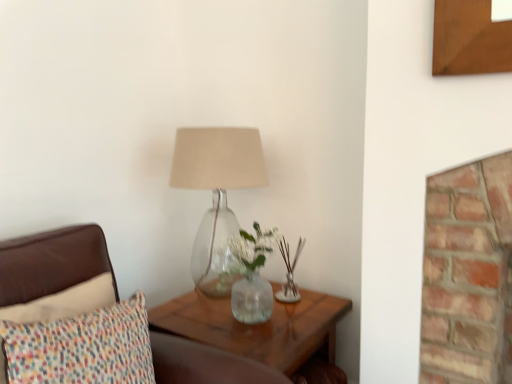
Question: Is multicolored fabric pillow at left a part of translucent wood table at lower right?

Choices:
 (A) no
 (B) yes

Answer: (A)

Question: From a real-world perspective, is translucent wood table at lower right over multicolored fabric pillow at left?

Choices:
 (A) yes
 (B) no

Answer: (B)

Question: Is translucent wood table at lower right placed right next to multicolored fabric pillow at left?

Choices:
 (A) no
 (B) yes

Answer: (A)

Question: From a real-world perspective, is translucent wood table at lower right beneath multicolored fabric pillow at left?

Choices:
 (A) no
 (B) yes

Answer: (B)

Question: Is translucent wood table at lower right positioned far away from multicolored fabric pillow at left?

Choices:
 (A) no
 (B) yes

Answer: (A)

Question: Is translucent wood table at lower right facing away from multicolored fabric pillow at left?

Choices:
 (A) no
 (B) yes

Answer: (A)

Question: Is translucent glass lamp at center to the left of multicolored fabric pillow at left from the viewer's perspective?

Choices:
 (A) yes
 (B) no

Answer: (B)

Question: Is translucent glass lamp at center positioned behind multicolored fabric pillow at left?

Choices:
 (A) no
 (B) yes

Answer: (B)

Question: Considering the relative sizes of translucent glass lamp at center and multicolored fabric pillow at left in the image provided, is translucent glass lamp at center shorter than multicolored fabric pillow at left?

Choices:
 (A) no
 (B) yes

Answer: (A)

Question: Is translucent glass lamp at center oriented towards multicolored fabric pillow at left?

Choices:
 (A) yes
 (B) no

Answer: (B)

Question: Does translucent glass lamp at center have a greater width compared to multicolored fabric pillow at left?

Choices:
 (A) no
 (B) yes

Answer: (B)

Question: Is translucent glass lamp at center located outside multicolored fabric pillow at left?

Choices:
 (A) yes
 (B) no

Answer: (A)

Question: Does multicolored fabric pillow at left have a larger size compared to translucent glass lamp at center?

Choices:
 (A) yes
 (B) no

Answer: (B)